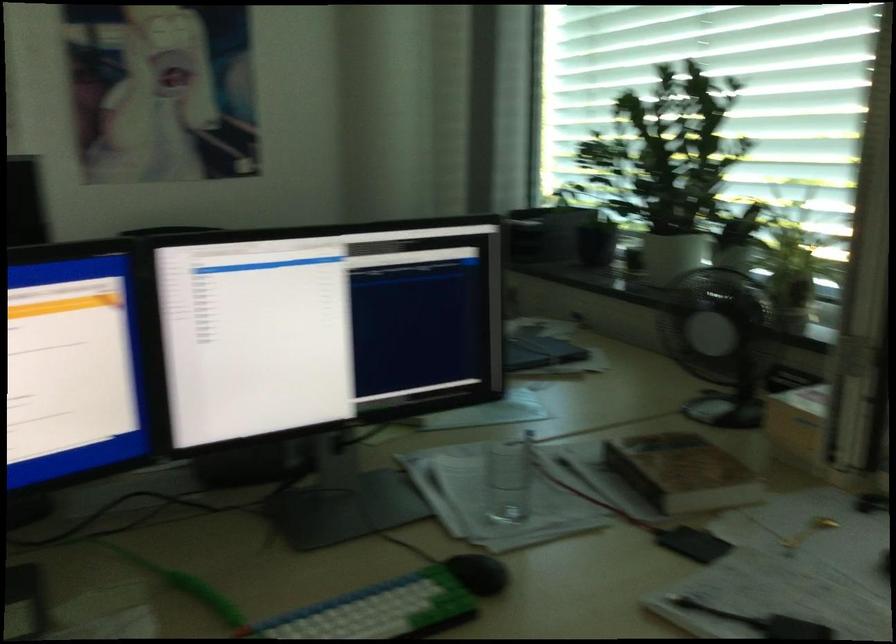
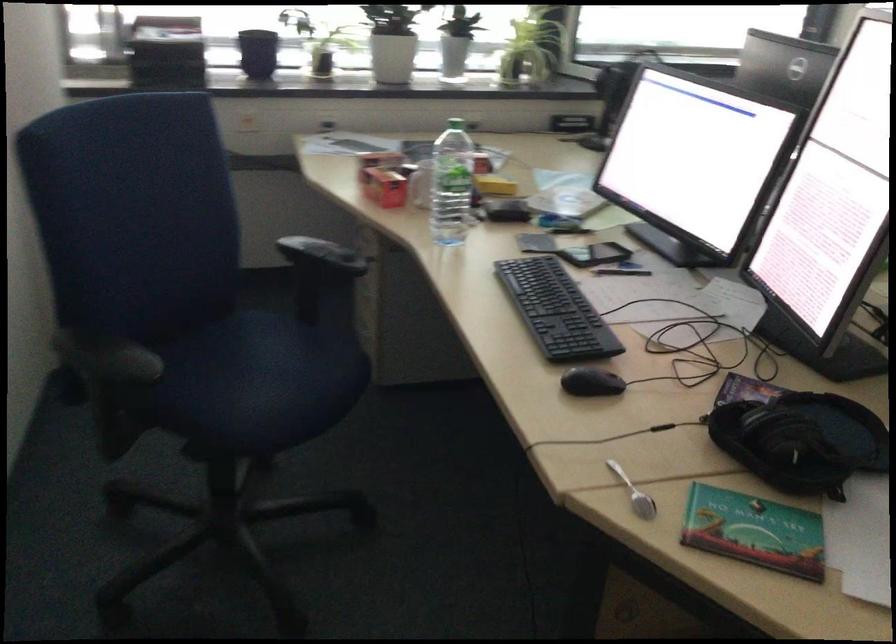
In the second image, find the point that corresponds to point 679,265 in the first image.

(392, 58)